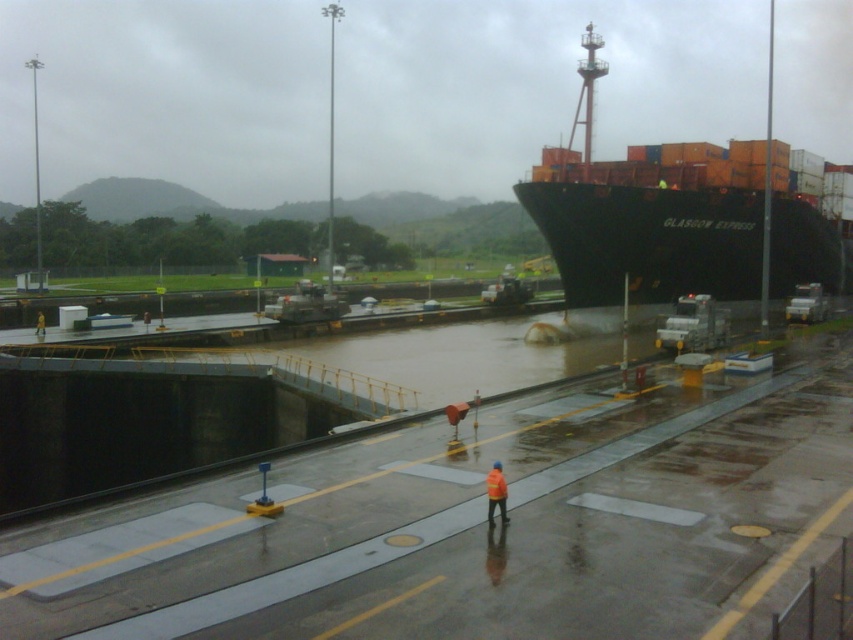
Question: Which point appears farthest from the camera in this image?

Choices:
 (A) (781, 172)
 (B) (491, 506)

Answer: (A)

Question: Where is black matte container ship at upper right located in relation to orange reflective jacket at center in the image?

Choices:
 (A) below
 (B) above

Answer: (B)

Question: In this image, where is black matte container ship at upper right located relative to orange reflective jacket at center?

Choices:
 (A) above
 (B) below

Answer: (A)

Question: Is black matte container ship at upper right closer to the viewer compared to orange reflective jacket at center?

Choices:
 (A) no
 (B) yes

Answer: (A)

Question: Which object appears farthest from the camera in this image?

Choices:
 (A) black matte container ship at upper right
 (B) orange reflective jacket at center

Answer: (A)